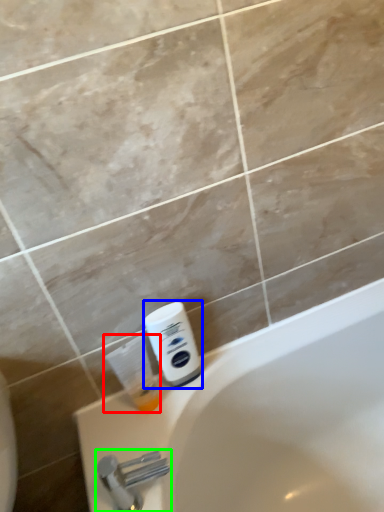
Question: Which object is positioned farthest from cleaning product (highlighted by a red box)? Select from shaving cream (highlighted by a blue box) and tap (highlighted by a green box).

Choices:
 (A) shaving cream
 (B) tap

Answer: (B)